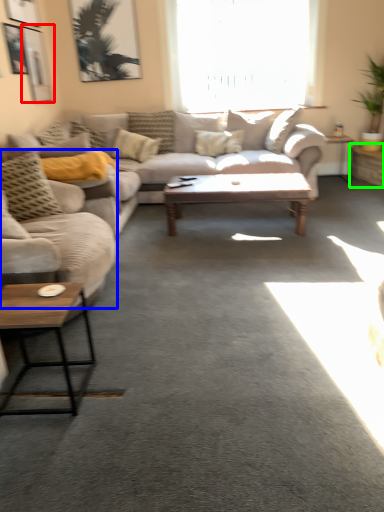
Question: Estimate the real-world distances between objects in this image. Which object is farther from picture frame (highlighted by a red box), studio couch (highlighted by a blue box) or table (highlighted by a green box)?

Choices:
 (A) studio couch
 (B) table

Answer: (B)